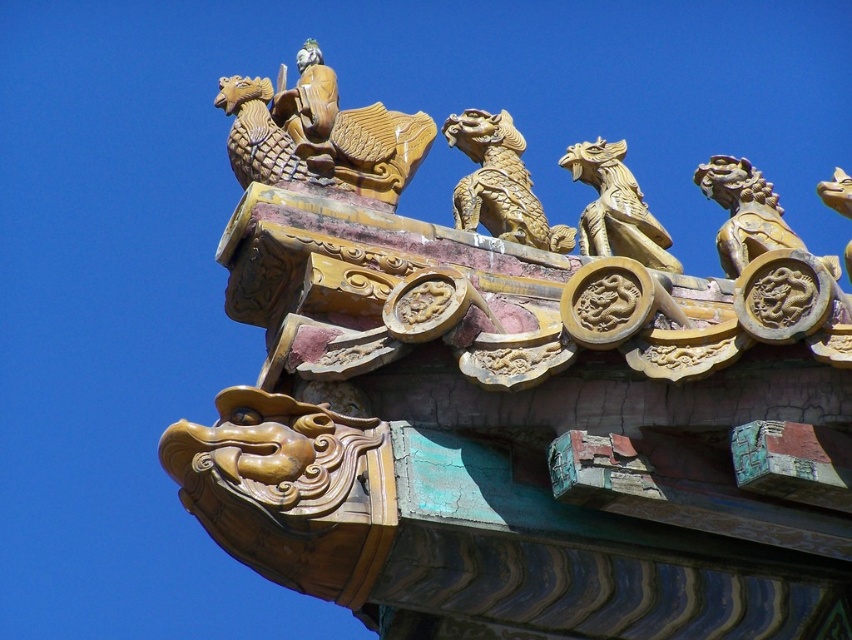
Looking at this image, you are an architect analyzing the symmetry of the roof eaves in the image. The point representing the gold gilded dragon at upper center is located at coordinates point (320, 132). If the roof eaves are perfectly symmetrical along the vertical axis, what would be the coordinates of the dragon mirrored on the opposite side?

The coordinates of the mirrored dragon would be point 0.791, 0.376 since the vertical axis symmetry would invert the horizontal coordinate while keeping the vertical coordinate the same.